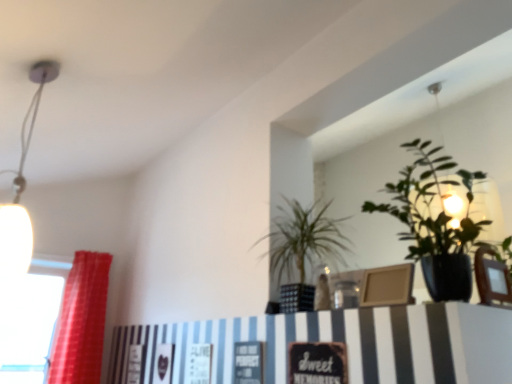
The height and width of the screenshot is (384, 512). I want to click on green leafy plant at center, the first houseplant from the left, so 302,248.

Based on the photo, what is the approximate height of transparent glass window at left?

85.78 centimeters.

Find the location of a particular element. The width and height of the screenshot is (512, 384). red fabric curtain at left is located at coordinates click(81, 321).

Identify the location of white glossy lamp at upper left. This screenshot has height=384, width=512. (22, 188).

Find the location of a particular element. green leafy plant at center, the first houseplant from the left is located at coordinates (302, 248).

Is green glossy plant at upper right, arranged as the 2th houseplant when viewed from the left, thinner than white glossy lamp at upper left?

No.

From the image's perspective, is green glossy plant at upper right, which ranks as the first houseplant in right-to-left order, located above or below white glossy lamp at upper left?

green glossy plant at upper right, which ranks as the first houseplant in right-to-left order, is situated lower than white glossy lamp at upper left in the image.

Is green glossy plant at upper right, arranged as the 2th houseplant when viewed from the left, oriented towards white glossy lamp at upper left?

No, green glossy plant at upper right, arranged as the 2th houseplant when viewed from the left, is not oriented towards white glossy lamp at upper left.

From a real-world perspective, does green leafy plant at center, the second houseplant from the right, sit lower than red fabric curtain at left?

Actually, green leafy plant at center, the second houseplant from the right, is physically above red fabric curtain at left in the real world.

How far apart are green leafy plant at center, the second houseplant from the right, and red fabric curtain at left?

green leafy plant at center, the second houseplant from the right, is 5.79 feet away from red fabric curtain at left.

Can you tell me how much green leafy plant at center, the second houseplant from the right, and red fabric curtain at left differ in facing direction?

87.6 degrees separate the facing orientations of green leafy plant at center, the second houseplant from the right, and red fabric curtain at left.

Between green leafy plant at center, the first houseplant from the left, and red fabric curtain at left, which one appears on the left side from the viewer's perspective?

red fabric curtain at left.

Does green leafy plant at center, the first houseplant from the left, lie in front of white glossy lamp at upper left?

No, the depth of green leafy plant at center, the first houseplant from the left, is greater than that of white glossy lamp at upper left.

Considering the sizes of objects green leafy plant at center, the first houseplant from the left, and white glossy lamp at upper left in the image provided, who is taller, green leafy plant at center, the first houseplant from the left, or white glossy lamp at upper left?

With more height is white glossy lamp at upper left.

Can you confirm if green leafy plant at center, the first houseplant from the left, is thinner than white glossy lamp at upper left?

No, green leafy plant at center, the first houseplant from the left, is not thinner than white glossy lamp at upper left.

In the image, there is a green leafy plant at center, the second houseplant from the right. Where is `lamp above it (from the image's perspective)`? lamp above it (from the image's perspective) is located at coordinates (22, 188).

Which is further, [46,344] or [74,272]?

The point [74,272] is behind.

From the picture: From a real-world perspective, is transparent glass window at left physically located above or below red fabric curtain at left?

Clearly, from a real-world perspective, transparent glass window at left is below red fabric curtain at left.

Is transparent glass window at left situated inside red fabric curtain at left or outside?

transparent glass window at left is not inside red fabric curtain at left, it's outside.

Is transparent glass window at left touching red fabric curtain at left?

There is a gap between transparent glass window at left and red fabric curtain at left.

Which object is thinner, green leafy plant at center, the first houseplant from the left, or green glossy plant at upper right, which ranks as the first houseplant in right-to-left order?

green leafy plant at center, the first houseplant from the left.

Considering the relative sizes of green leafy plant at center, the first houseplant from the left, and green glossy plant at upper right, which ranks as the first houseplant in right-to-left order, in the image provided, is green leafy plant at center, the first houseplant from the left, smaller than green glossy plant at upper right, which ranks as the first houseplant in right-to-left order,?

Correct, green leafy plant at center, the first houseplant from the left, occupies less space than green glossy plant at upper right, which ranks as the first houseplant in right-to-left order.

Is green leafy plant at center, the first houseplant from the left, next to green glossy plant at upper right, which ranks as the first houseplant in right-to-left order, and touching it?

green leafy plant at center, the first houseplant from the left, is not next to green glossy plant at upper right, which ranks as the first houseplant in right-to-left order, and they're not touching.

Consider the image. From the image's perspective, is green leafy plant at center, the first houseplant from the left, located above or below green glossy plant at upper right, arranged as the 2th houseplant when viewed from the left?

green leafy plant at center, the first houseplant from the left, is below green glossy plant at upper right, arranged as the 2th houseplant when viewed from the left.

Which of these two, white glossy lamp at upper left or green leafy plant at center, the second houseplant from the right, is smaller?

With smaller size is white glossy lamp at upper left.

Which of these two, white glossy lamp at upper left or green leafy plant at center, the first houseplant from the left, stands shorter?

green leafy plant at center, the first houseplant from the left.

From the picture: Which is closer, (25,120) or (317,258)?

Point (25,120) is closer to the camera than point (317,258).

Is white glossy lamp at upper left facing towards green leafy plant at center, the first houseplant from the left?

No, white glossy lamp at upper left is not turned towards green leafy plant at center, the first houseplant from the left.

Considering the positions of objects green glossy plant at upper right, arranged as the 2th houseplant when viewed from the left, and green leafy plant at center, the second houseplant from the right, in the image provided, who is more to the left, green glossy plant at upper right, arranged as the 2th houseplant when viewed from the left, or green leafy plant at center, the second houseplant from the right,?

From the viewer's perspective, green leafy plant at center, the second houseplant from the right, appears more on the left side.

Between green glossy plant at upper right, arranged as the 2th houseplant when viewed from the left, and green leafy plant at center, the first houseplant from the left, which one is positioned in front?

green glossy plant at upper right, arranged as the 2th houseplant when viewed from the left, is in front.

From the image's perspective, would you say green glossy plant at upper right, arranged as the 2th houseplant when viewed from the left, is shown under green leafy plant at center, the first houseplant from the left?

No.

Is green glossy plant at upper right, arranged as the 2th houseplant when viewed from the left, not close to green leafy plant at center, the second houseplant from the right?

green glossy plant at upper right, arranged as the 2th houseplant when viewed from the left, is actually quite close to green leafy plant at center, the second houseplant from the right.

I want to click on houseplant in front of the white glossy lamp at upper left, so click(435, 221).

Locate an element on the screen. curtain below the green leafy plant at center, the second houseplant from the right (from the image's perspective) is located at coordinates 81,321.

In the scene shown: From the image, which object appears to be nearer to green leafy plant at center, the second houseplant from the right, white glossy lamp at upper left or red fabric curtain at left?

white glossy lamp at upper left lies closer to green leafy plant at center, the second houseplant from the right, than the other object.

Which object lies nearer to the anchor point transparent glass window at left, green glossy plant at upper right, arranged as the 2th houseplant when viewed from the left, or white glossy lamp at upper left?

white glossy lamp at upper left is closer to transparent glass window at left.

In the scene shown: Based on their spatial positions, is red fabric curtain at left or green leafy plant at center, the second houseplant from the right, closer to green glossy plant at upper right, which ranks as the first houseplant in right-to-left order?

green leafy plant at center, the second houseplant from the right.

Which object lies further to the anchor point green glossy plant at upper right, which ranks as the first houseplant in right-to-left order, transparent glass window at left or green leafy plant at center, the first houseplant from the left?

Among the two, transparent glass window at left is located further to green glossy plant at upper right, which ranks as the first houseplant in right-to-left order.

Which object lies further to the anchor point red fabric curtain at left, white glossy lamp at upper left or transparent glass window at left?

The object further to red fabric curtain at left is white glossy lamp at upper left.

Which object lies nearer to the anchor point white glossy lamp at upper left, green glossy plant at upper right, arranged as the 2th houseplant when viewed from the left, or red fabric curtain at left?

The object closer to white glossy lamp at upper left is red fabric curtain at left.

Considering their positions, is green glossy plant at upper right, which ranks as the first houseplant in right-to-left order, positioned closer to green leafy plant at center, the second houseplant from the right, than red fabric curtain at left?

Among the two, green glossy plant at upper right, which ranks as the first houseplant in right-to-left order, is located nearer to green leafy plant at center, the second houseplant from the right.

Looking at the image, which one is located further to transparent glass window at left, green leafy plant at center, the first houseplant from the left, or green glossy plant at upper right, which ranks as the first houseplant in right-to-left order?

The object further to transparent glass window at left is green glossy plant at upper right, which ranks as the first houseplant in right-to-left order.

Find the location of a particular element. The image size is (512, 384). houseplant between white glossy lamp at upper left and green glossy plant at upper right, arranged as the 2th houseplant when viewed from the left is located at coordinates (302, 248).

Identify the location of houseplant situated between red fabric curtain at left and green glossy plant at upper right, which ranks as the first houseplant in right-to-left order, from left to right. (302, 248).

This screenshot has height=384, width=512. What are the coordinates of `curtain between transparent glass window at left and green leafy plant at center, the second houseplant from the right, in the horizontal direction` in the screenshot? It's located at (81, 321).

At what (x,y) coordinates should I click in order to perform the action: click on lamp situated between red fabric curtain at left and green glossy plant at upper right, which ranks as the first houseplant in right-to-left order, from left to right. Please return your answer as a coordinate pair (x, y). Looking at the image, I should click on (22, 188).